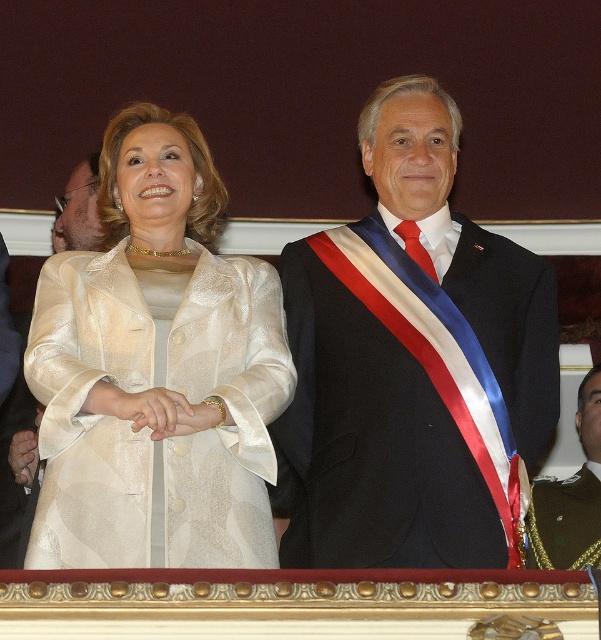
Is ivory silk dress at center thinner than green textured uniform at right?

No, ivory silk dress at center is not thinner than green textured uniform at right.

Is point (88, 520) farther from camera compared to point (581, 416)?

No, (88, 520) is in front of (581, 416).

Which is behind, point (273, 467) or point (597, 525)?

The point (597, 525) is more distant.

Where is `ivory silk dress at center`? ivory silk dress at center is located at coordinates (147, 426).

Is shiny black suit at center below ivory silk dress at center?

Actually, shiny black suit at center is above ivory silk dress at center.

Can you confirm if shiny black suit at center is positioned to the right of ivory silk dress at center?

Indeed, shiny black suit at center is positioned on the right side of ivory silk dress at center.

Locate an element on the screen. The image size is (601, 640). shiny black suit at center is located at coordinates point(413,362).

The width and height of the screenshot is (601, 640). Find the location of `shiny black suit at center`. shiny black suit at center is located at coordinates (413, 362).

Based on the photo, can you confirm if shiny black suit at center is positioned to the right of silky beige suit at center?

Yes, shiny black suit at center is to the right of silky beige suit at center.

Is point (450, 316) positioned after point (38, 416)?

No, (450, 316) is in front of (38, 416).

Identify the location of shiny black suit at center. The width and height of the screenshot is (601, 640). (413, 362).